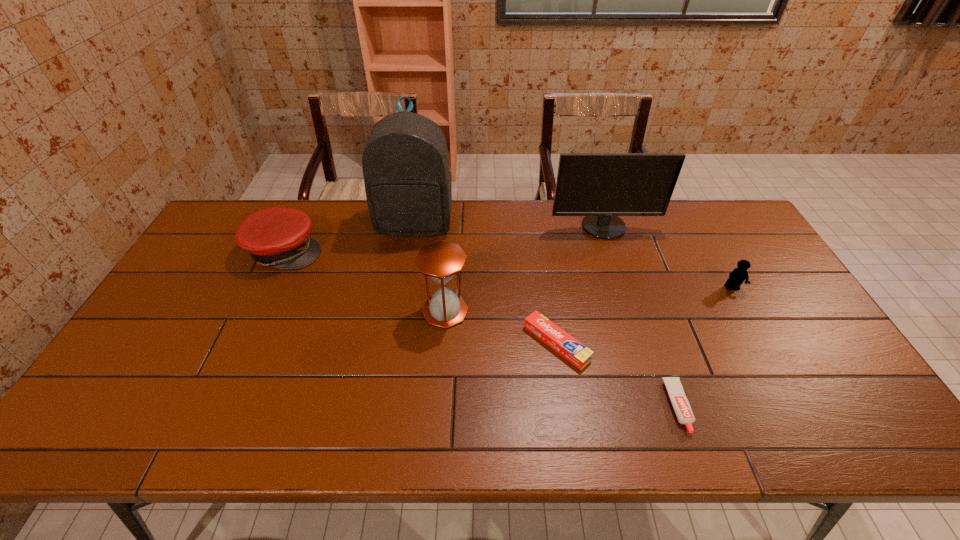
Where is `the tallest object`? The width and height of the screenshot is (960, 540). the tallest object is located at coordinates (406, 170).

You are a GUI agent. You are given a task and a screenshot of the screen. Output one action in this format:
    pyautogui.click(x=<x>, y=<y>)
    Task: Click on the sixth shortest object
    
    Given the screenshot: What is the action you would take?
    pyautogui.click(x=600, y=186)

The image size is (960, 540). Identify the location of hourglass. (441, 261).

The image size is (960, 540). I want to click on cap, so click(278, 237).

Identify the location of the fourth nearest object. (738, 275).

Where is `Lego`? Lego is located at coordinates (738, 275).

At what (x,y) coordinates should I click in order to perform the action: click on the farther toothpaste. Please return your answer as a coordinate pair (x, y). The height and width of the screenshot is (540, 960). Looking at the image, I should click on (579, 355).

Identify the location of the shorter toothpaste. (680, 403).

Where is `the shortest object`? The image size is (960, 540). the shortest object is located at coordinates (680, 403).

At what (x,y) coordinates should I click in order to perform the action: click on free region located 0.340m on the front-facing side of the backpack. Please return your answer as a coordinate pair (x, y). Image resolution: width=960 pixels, height=540 pixels. Looking at the image, I should click on (398, 325).